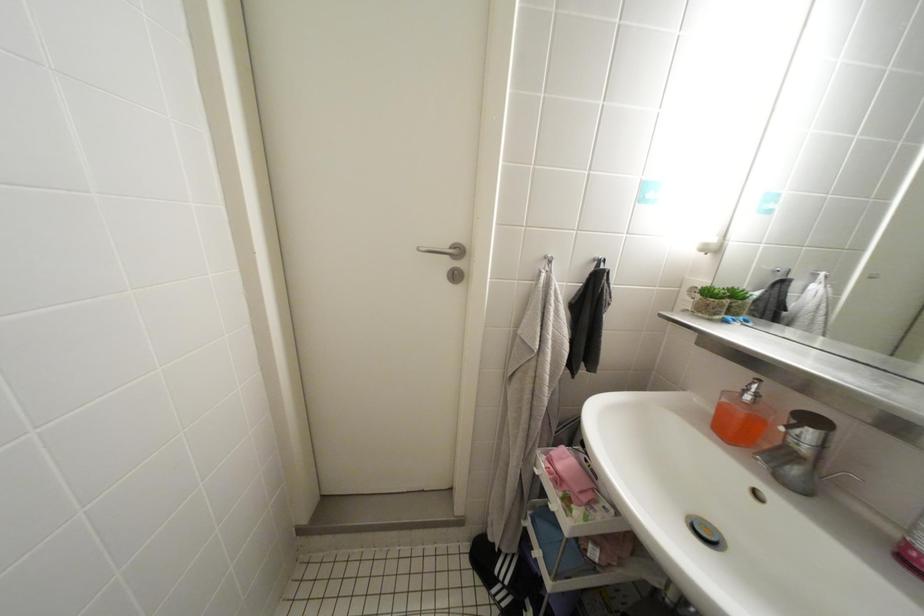
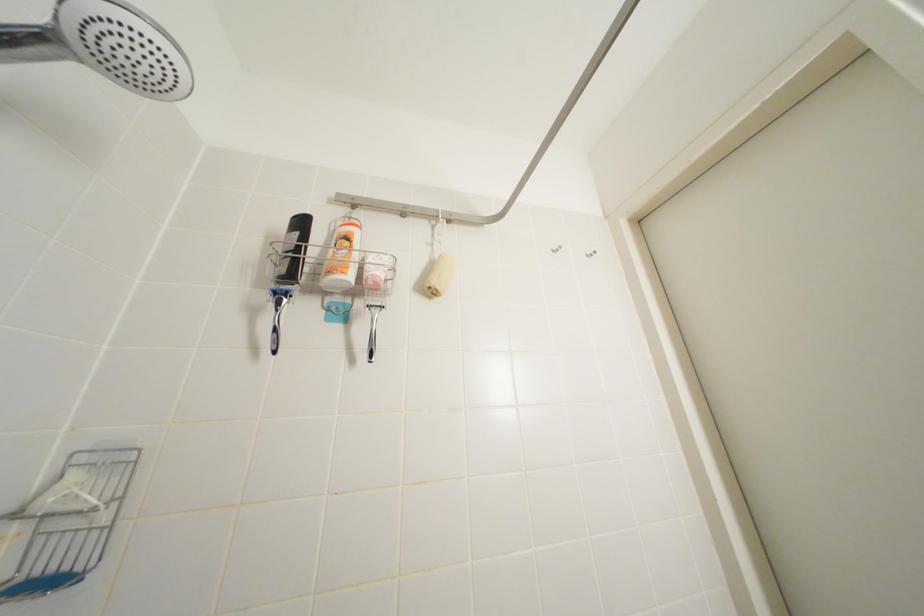
The images are taken continuously from a first-person perspective. In which direction is your viewpoint rotating?

The camera's rotation is toward left-up.